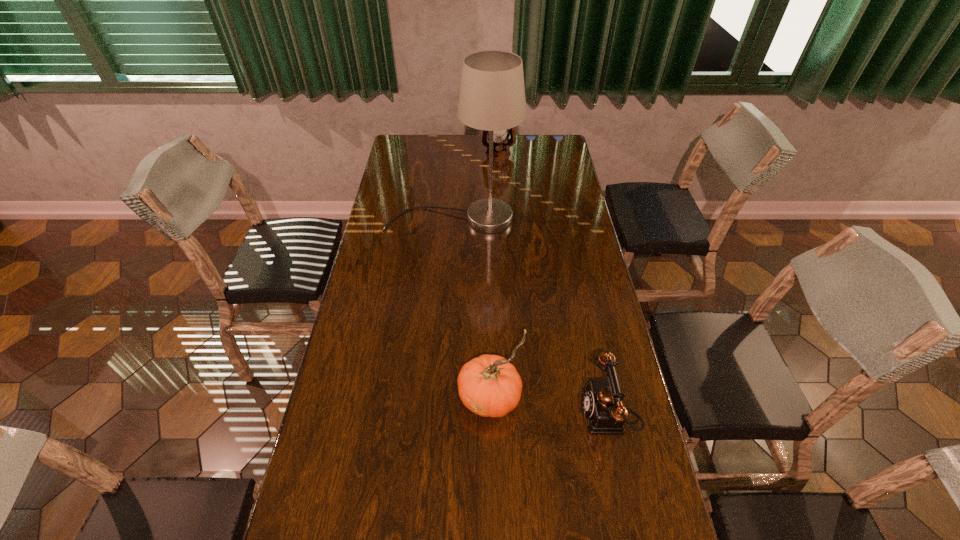
The width and height of the screenshot is (960, 540). In order to click on vacant region located on the front of the telephone at the rotary dial in this screenshot , I will do `click(438, 414)`.

The image size is (960, 540). I want to click on free point located 0.270m on the front of the telephone at the rotary dial, so click(x=479, y=414).

This screenshot has width=960, height=540. In order to click on object that is at the far edge in this screenshot , I will do `click(501, 151)`.

Identify the location of object present at the left edge. (492, 95).

Identify the location of object located in the right edge section of the desktop. coord(602,400).

Where is `vacant region at the far edge of the desktop`? The image size is (960, 540). vacant region at the far edge of the desktop is located at coordinates (529, 144).

In the image, there is a desktop. Where is `free space at the left edge`? The height and width of the screenshot is (540, 960). free space at the left edge is located at coordinates (342, 487).

The width and height of the screenshot is (960, 540). I want to click on free region at the right edge of the desktop, so click(x=542, y=165).

Where is `free area in between the telephone and the lantern`? free area in between the telephone and the lantern is located at coordinates (553, 284).

I want to click on empty space between the telephone and the farthest object, so click(553, 284).